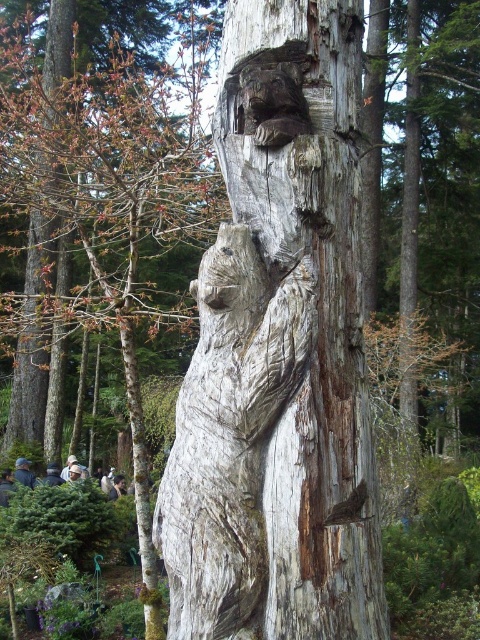
You are an artist examining the weathered wood carving at center and the gray wood bear at center. From your viewpoint, which object is positioned to the left?

The gray wood bear at center is positioned to the left of the weathered wood carving at center according to the description provided.

You are standing in front of the carved bear on the tree trunk and notice two points marked on the carving. The first point is at coordinates point [292,396] and the second at point [256,477]. Which point is nearer to you?

Point [292,396] is closer to the viewer than point [256,477].